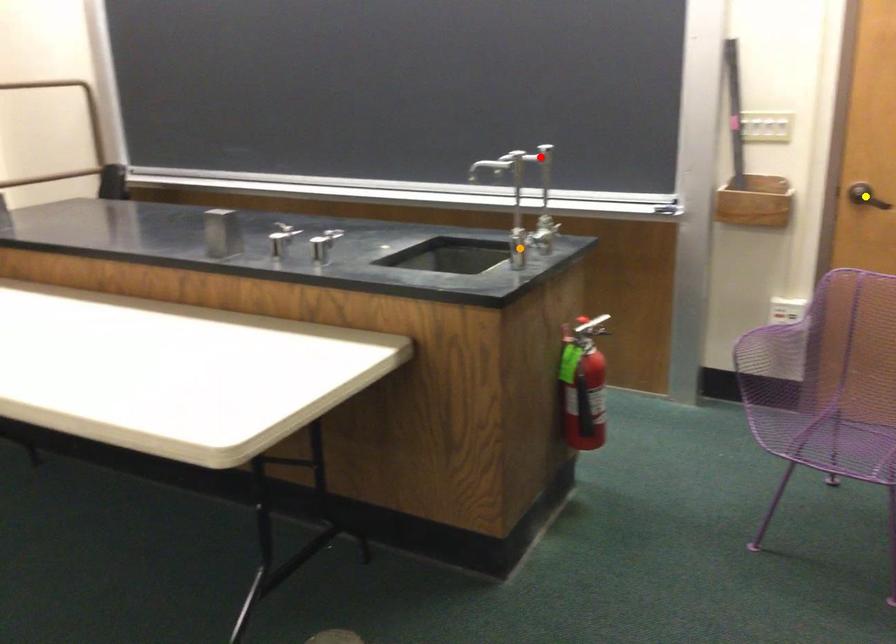
Order these from nearest to farthest:
A) yellow point
B) red point
C) orange point

1. orange point
2. yellow point
3. red point